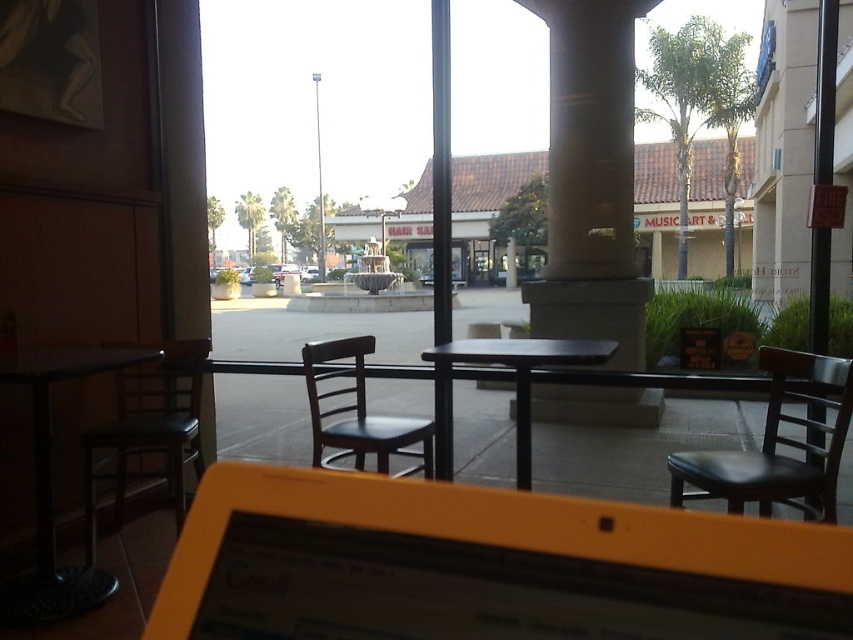
Question: Which point is farther to the camera?

Choices:
 (A) (436, 156)
 (B) (618, 333)
 (C) (548, 292)

Answer: (C)

Question: Is yellow plastic laptop at center bigger than black metal pole at center?

Choices:
 (A) no
 (B) yes

Answer: (A)

Question: Is concrete column at center in front of black metal pole at center?

Choices:
 (A) no
 (B) yes

Answer: (A)

Question: Which point is farther to the camera?

Choices:
 (A) (556, 540)
 (B) (440, 444)
 (C) (457, 257)
 (D) (57, 360)

Answer: (C)

Question: Is metallic black table at left to the left of black leather chair at center from the viewer's perspective?

Choices:
 (A) yes
 (B) no

Answer: (A)

Question: Among these points, which one is nearest to the camera?

Choices:
 (A) (33, 600)
 (B) (351, 449)
 (C) (430, 349)
 (D) (428, 269)

Answer: (A)